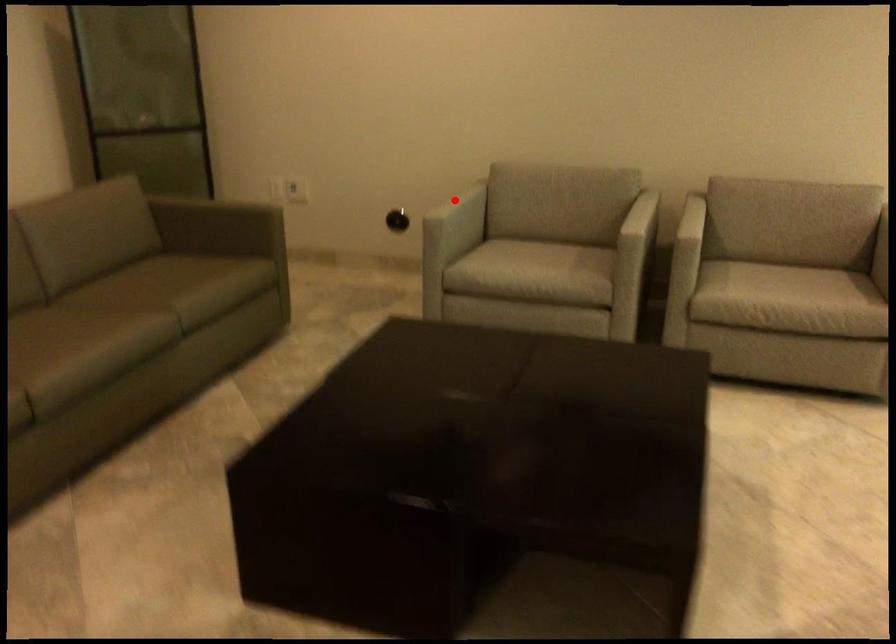
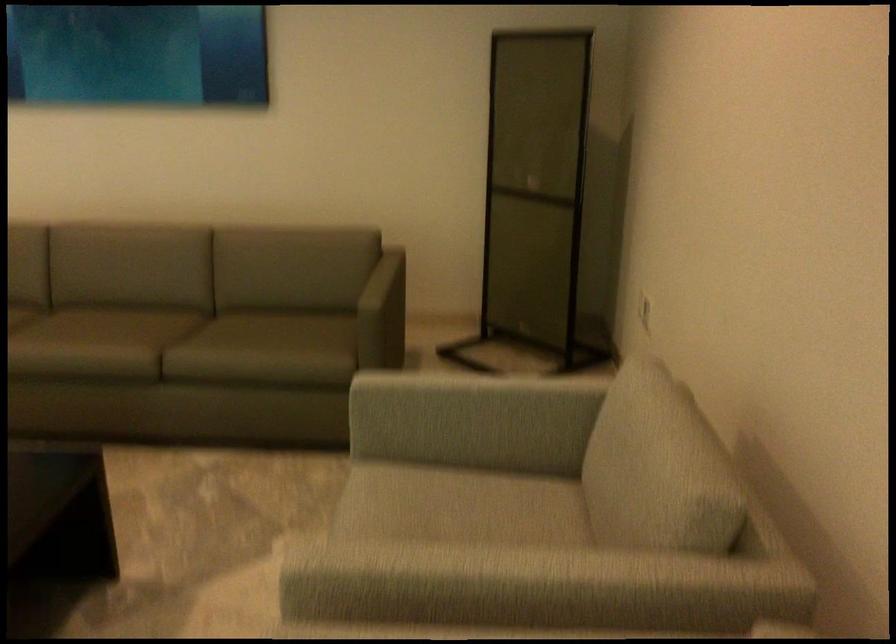
Find the pixel in the second image that matches the highlighted location in the first image.

(469, 399)